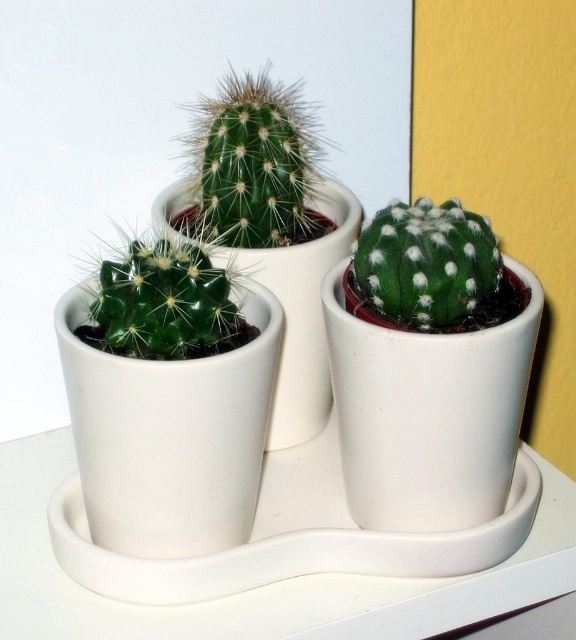
Question: Is green spiny cactus at center positioned in front of green fuzzy cactus at right?

Choices:
 (A) yes
 (B) no

Answer: (B)

Question: Which object is positioned farthest from the green matte cactus at center?

Choices:
 (A) green fuzzy cactus at right
 (B) green spiny cactus at center

Answer: (A)

Question: Is green spiny cactus at center to the left of green matte cactus at center from the viewer's perspective?

Choices:
 (A) no
 (B) yes

Answer: (A)

Question: Can you confirm if green spiny cactus at center is smaller than green fuzzy cactus at right?

Choices:
 (A) yes
 (B) no

Answer: (B)

Question: Which object is positioned farthest from the green matte cactus at center?

Choices:
 (A) green spiny cactus at center
 (B) green fuzzy cactus at right

Answer: (B)

Question: Which point is farther to the camera?

Choices:
 (A) (111, 337)
 (B) (403, 291)

Answer: (B)